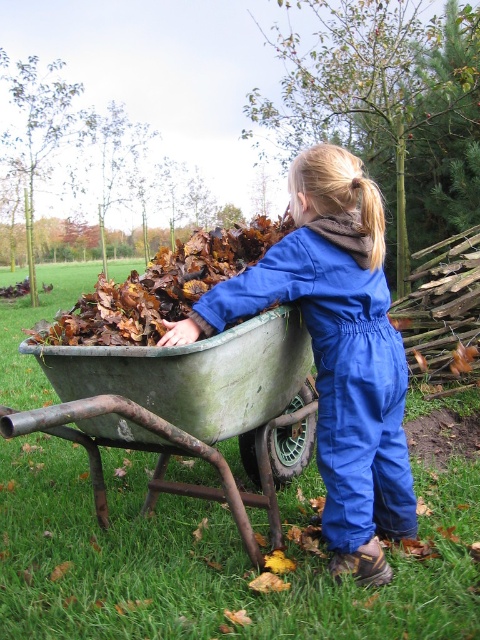
Is blue cotton jumpsuit at center closer to camera compared to brown fuzzy hair at upper center?

That is True.

Who is more distant from viewer, (380, 480) or (367, 220)?

Point (380, 480)

Does point (387, 470) come closer to viewer compared to point (373, 205)?

No.

This screenshot has height=640, width=480. I want to click on blue cotton jumpsuit at center, so click(335, 358).

Identify the location of blue cotton jumpsuit at center. (335, 358).

The height and width of the screenshot is (640, 480). I want to click on blue cotton jumpsuit at center, so click(x=335, y=358).

Who is positioned more to the left, rusty metal wheelbarrow at center or brown fuzzy hair at upper center?

Positioned to the left is rusty metal wheelbarrow at center.

Which of these two, rusty metal wheelbarrow at center or brown fuzzy hair at upper center, stands taller?

rusty metal wheelbarrow at center

Image resolution: width=480 pixels, height=640 pixels. Find the location of `rusty metal wheelbarrow at center`. rusty metal wheelbarrow at center is located at coordinates (181, 406).

Identify the location of rusty metal wheelbarrow at center. (181, 406).